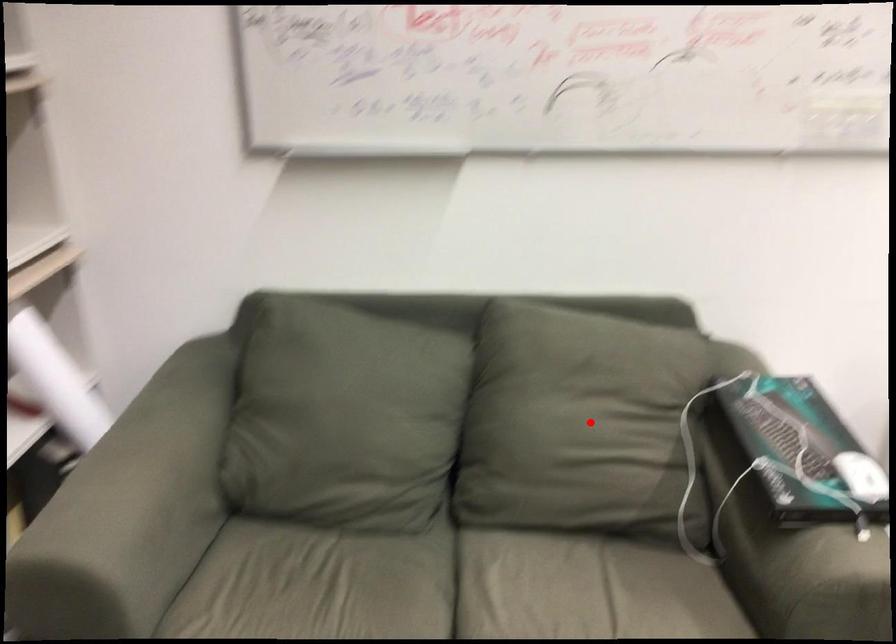
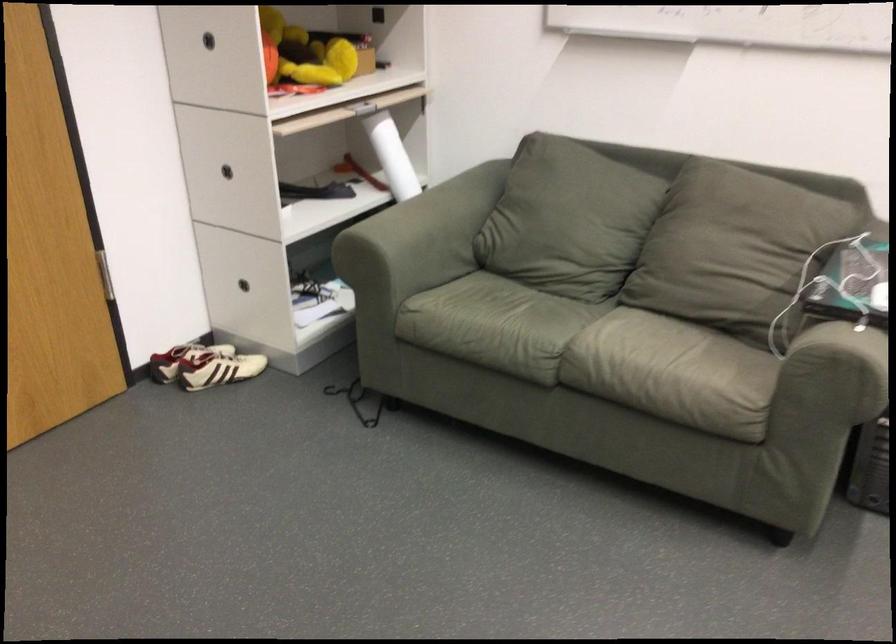
Question: I am providing you with two images of the same scene from different viewpoints. In image1, a red point is highlighted. Considering the same 3D point in image2, which of the following is correct?

Choices:
 (A) It is closer
 (B) It is farther

Answer: (B)